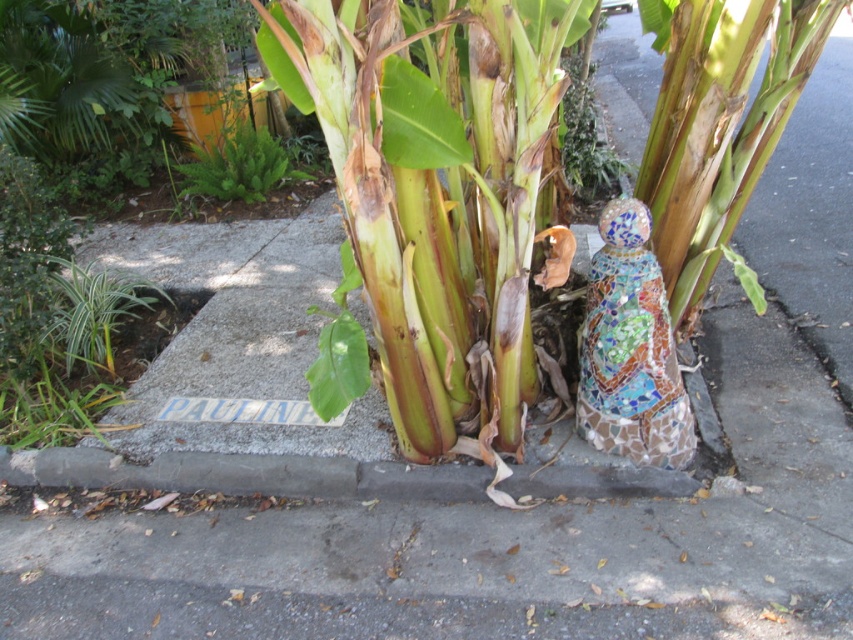
Consider the image. Between green matte banana tree at center and mosaic figure at center, which one appears on the left side from the viewer's perspective?

From the viewer's perspective, green matte banana tree at center appears more on the left side.

Can you confirm if green matte banana tree at center is shorter than mosaic figure at center?

In fact, green matte banana tree at center may be taller than mosaic figure at center.

Who is more distant from viewer, (527, 17) or (579, 426)?

Positioned behind is point (579, 426).

Locate an element on the screen. The height and width of the screenshot is (640, 853). green matte banana tree at center is located at coordinates (439, 192).

Who is more distant from viewer, (453, 173) or (45, 474)?

The point (45, 474) is more distant.

Does green matte banana tree at center appear under gray concrete curb at lower center?

Actually, green matte banana tree at center is above gray concrete curb at lower center.

Describe the element at coordinates (439, 192) in the screenshot. This screenshot has width=853, height=640. I see `green matte banana tree at center` at that location.

Identify the location of green matte banana tree at center. (439, 192).

Between gray concrete curb at lower center and mosaic figure at center, which one is positioned higher?

mosaic figure at center

The width and height of the screenshot is (853, 640). Identify the location of gray concrete curb at lower center. (245, 474).